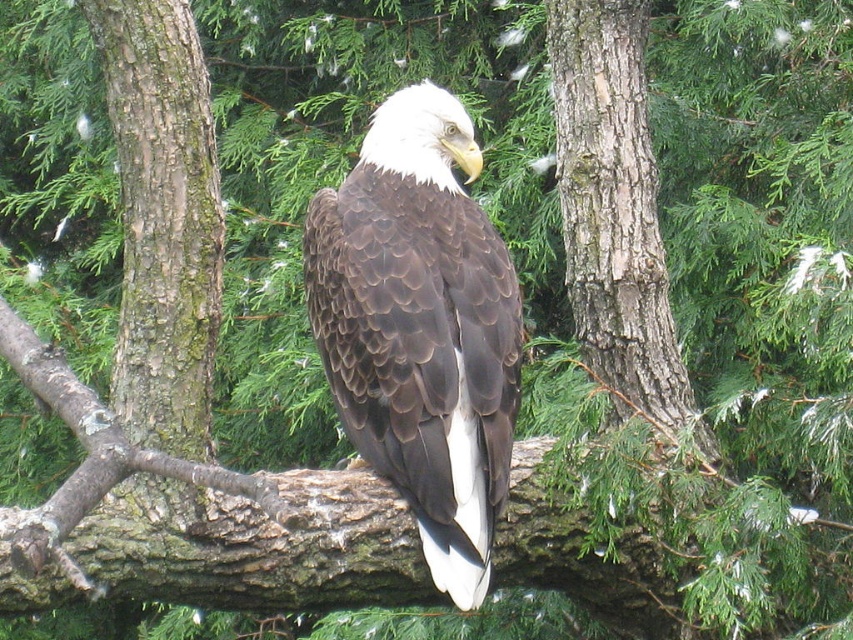
Does brown textured feathers at center have a greater height compared to smooth bark tree trunk at center?

In fact, brown textured feathers at center may be shorter than smooth bark tree trunk at center.

Between point (474, 401) and point (619, 198), which one is positioned behind?

The point (619, 198) is more distant.

At what (x,y) coordinates should I click in order to perform the action: click on brown textured feathers at center. Please return your answer as a coordinate pair (x, y). This screenshot has height=640, width=853. Looking at the image, I should click on (421, 326).

From the picture: Between brown rough bark at center and smooth bark tree trunk at center, which one appears on the left side from the viewer's perspective?

brown rough bark at center

Who is taller, brown rough bark at center or smooth bark tree trunk at center?

With more height is smooth bark tree trunk at center.

From the picture: Who is more forward, (120, 4) or (622, 369)?

Point (120, 4)

Where is `brown rough bark at center`? brown rough bark at center is located at coordinates (163, 246).

Can you confirm if brown textured feathers at center is smaller than brown rough bark at center?

Actually, brown textured feathers at center might be larger than brown rough bark at center.

Between brown textured feathers at center and brown rough bark at center, which one is positioned higher?

brown rough bark at center

Does point (421, 264) come closer to viewer compared to point (111, 582)?

Yes, it is.

Identify the location of brown textured feathers at center. Image resolution: width=853 pixels, height=640 pixels. (421, 326).